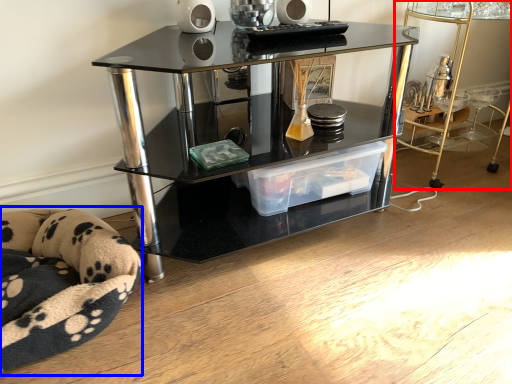
Question: Which object appears closest to the camera in this image, table (highlighted by a red box) or swivel chair (highlighted by a blue box)?

Choices:
 (A) table
 (B) swivel chair

Answer: (B)